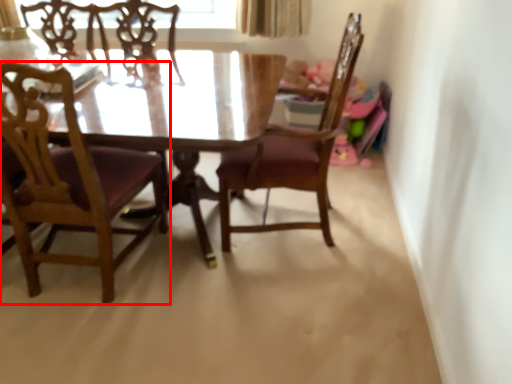
Question: Where is chair (annotated by the red box) located in relation to chair in the image?

Choices:
 (A) left
 (B) right

Answer: (A)